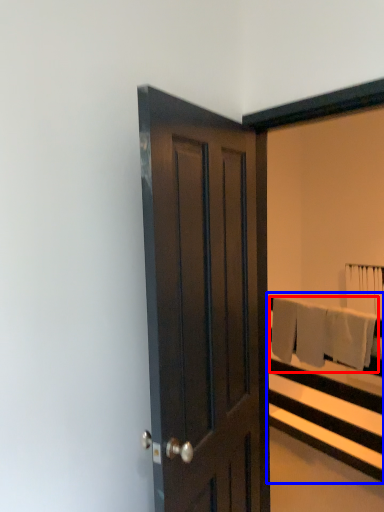
Question: Among these objects, which one is nearest to the camera, bath towel (highlighted by a red box) or bed frame (highlighted by a blue box)?

Choices:
 (A) bath towel
 (B) bed frame

Answer: (B)